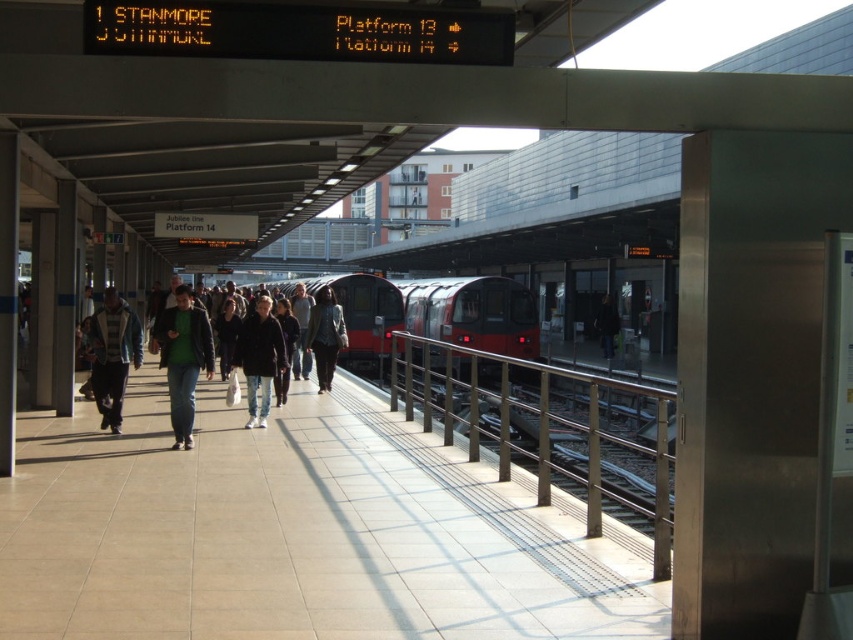
Question: Which point is closer to the camera taking this photo?

Choices:
 (A) (457, 321)
 (B) (252, 401)
 (C) (668, 618)
 (D) (167, 352)

Answer: (C)

Question: Among these objects, which one is nearest to the camera?

Choices:
 (A) light blue denim jacket at left
 (B) matte black jacket at center
 (C) dark green jacket at center
 (D) red glossy train at center

Answer: (C)

Question: Does red glossy train at center have a smaller size compared to dark green jacket at center?

Choices:
 (A) no
 (B) yes

Answer: (A)

Question: In this image, where is polished metal rail at right located relative to light blue denim jacket at left?

Choices:
 (A) right
 (B) left

Answer: (A)

Question: Is red glossy train at center above dark gray hoodie at center?

Choices:
 (A) no
 (B) yes

Answer: (B)

Question: Which of these objects is positioned farthest from the dark green jacket at center?

Choices:
 (A) dark gray hoodie at center
 (B) matte black jacket at center

Answer: (B)